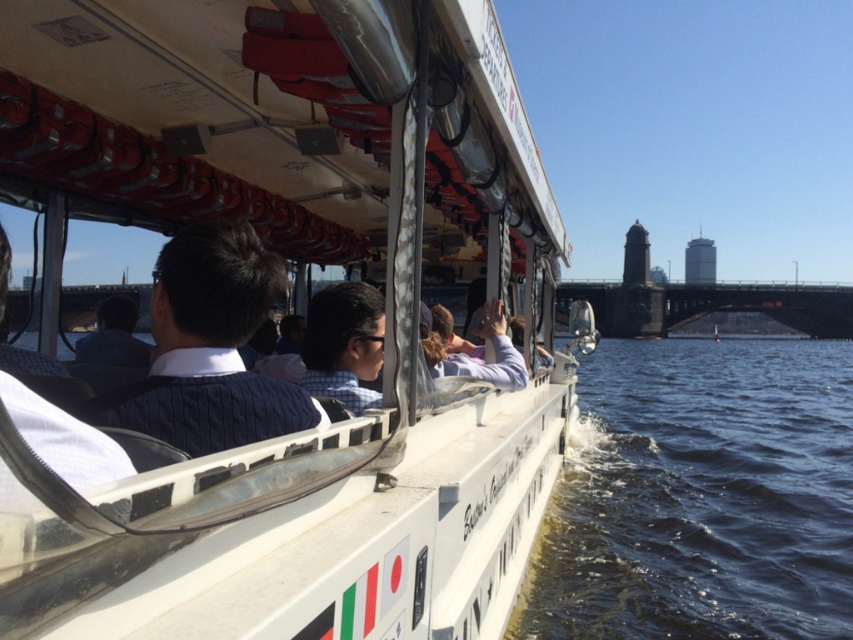
Is white plastic boat at center shorter than navy blue sweater at center?

Yes.

Can you confirm if white plastic boat at center is bigger than navy blue sweater at center?

No, white plastic boat at center is not bigger than navy blue sweater at center.

Does point (195, 358) lie behind point (163, 292)?

No, it is in front of (163, 292).

Where is `white plastic boat at center`? The width and height of the screenshot is (853, 640). white plastic boat at center is located at coordinates point(270,317).

Between white plastic boat at center and checkered fabric shirt at center, which one has less height?

white plastic boat at center is shorter.

Between white plastic boat at center and checkered fabric shirt at center, which one appears on the left side from the viewer's perspective?

white plastic boat at center

Does point (219, 445) come in front of point (361, 336)?

Yes, point (219, 445) is closer to viewer.

The image size is (853, 640). In order to click on white plastic boat at center in this screenshot , I will do `click(270, 317)`.

Is navy blue sweater at center above checkered fabric shirt at center?

Yes.

Who is positioned more to the left, navy blue sweater at center or checkered fabric shirt at center?

navy blue sweater at center is more to the left.

The width and height of the screenshot is (853, 640). What are the coordinates of `navy blue sweater at center` in the screenshot? It's located at (209, 348).